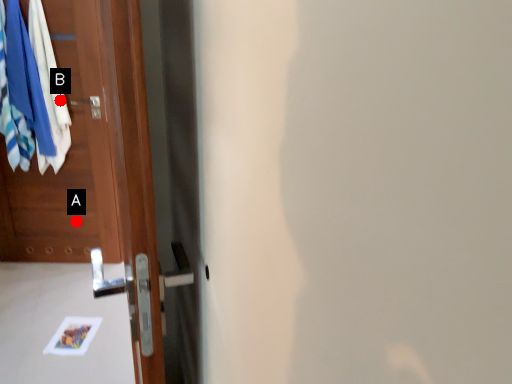
Question: Two points are circled on the image, labeled by A and B beside each circle. Which of the following is the closest to the observer?

Choices:
 (A) A is closer
 (B) B is closer

Answer: (B)